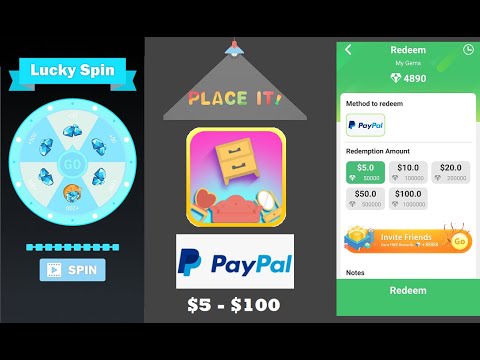
Point to any where you sit on chair in the image. Your answer should be formatted as a list of tuples, i.e. [(x1, y1), (x2, y2), ...], where each tuple contains the x and y coordinates of a point satisfying the conditions above.

[(197, 208)]